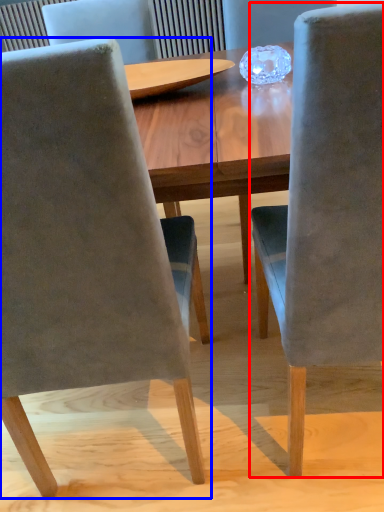
Question: Which object appears closest to the camera in this image, chair (highlighted by a red box) or chair (highlighted by a blue box)?

Choices:
 (A) chair
 (B) chair

Answer: (A)